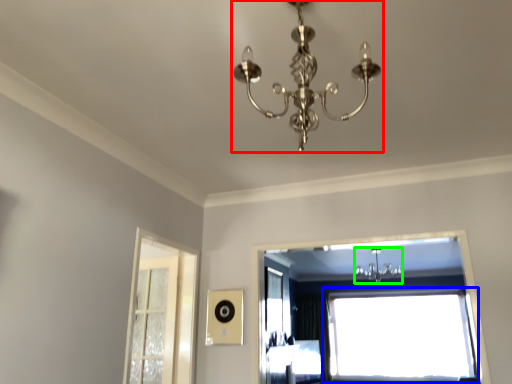
Question: Which object is the farthest from lamp (highlighted by a red box)? Choose among these: window (highlighted by a blue box) or light fixture (highlighted by a green box).

Choices:
 (A) window
 (B) light fixture

Answer: (A)